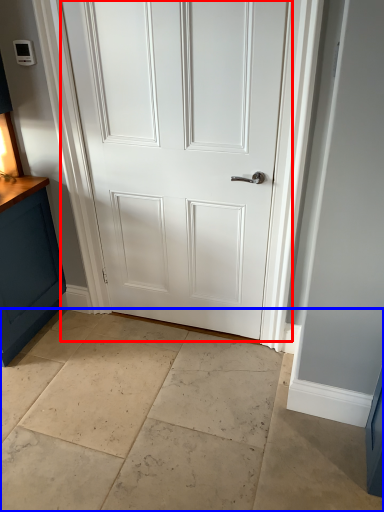
Question: Which object appears farthest to the camera in this image, door (highlighted by a red box) or concrete (highlighted by a blue box)?

Choices:
 (A) door
 (B) concrete

Answer: (A)